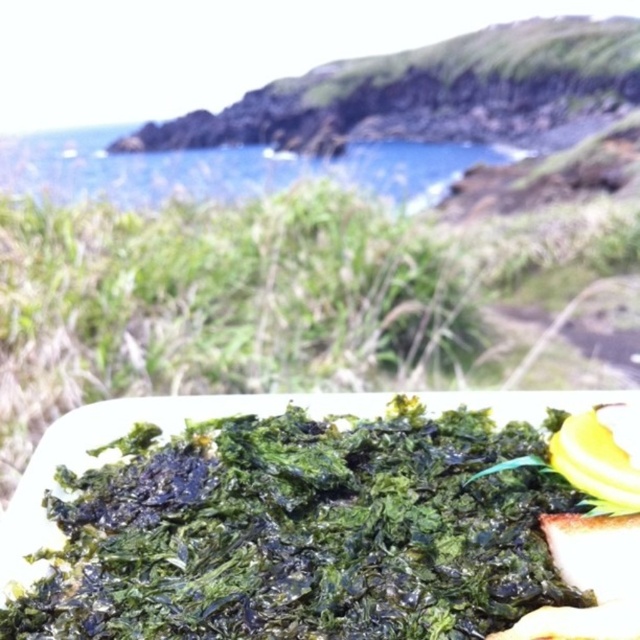
You are a photographer trying to capture a photo of the green crispy seaweed at bottom and the blue water at upper center. Which object should you adjust your camera to focus on first if you want to include both in the frame without moving the camera?

The green crispy seaweed at bottom should be focused on first because it is positioned to the right of the blue water at upper center, so adjusting focus on the seaweed ensures both are in the frame.

You are a photographer trying to capture the green crispy seaweed at bottom and the blue water at upper center in the same frame. Based on their positions, which one would appear closer to the camera?

The green crispy seaweed at bottom appears closer to the camera because it has a lesser height compared to the blue water at upper center, indicating it is positioned lower in the frame.

You are a photographer trying to capture the green crispy seaweed at bottom and the blue water at upper center in a single shot. Can you focus on both objects clearly at the same time?

The green crispy seaweed at bottom is in front of the blue water at upper center, so focusing on both clearly at the same time may be challenging due to their different distances from the camera.